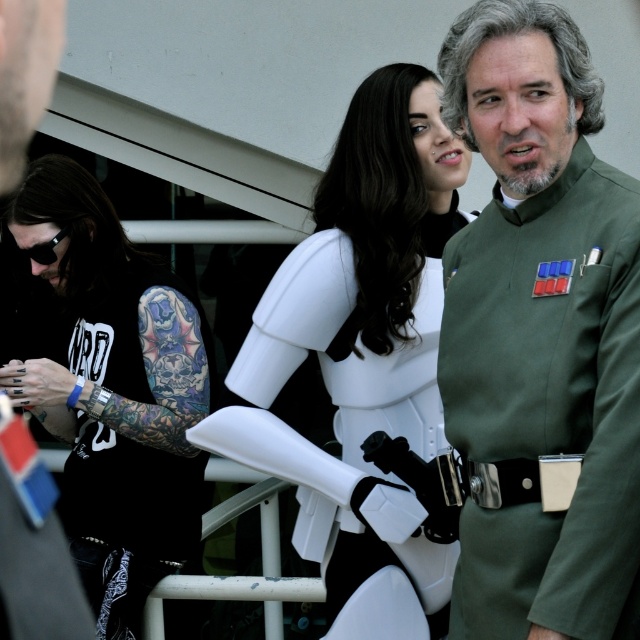
Describe the element at coordinates (372, 266) in the screenshot. The height and width of the screenshot is (640, 640). I see `white matte armor at center` at that location.

Can you confirm if white matte armor at center is positioned below matte green uniform at center right?

Yes.

Find the location of a particular element. The width and height of the screenshot is (640, 640). white matte armor at center is located at coordinates (372, 266).

Consider the image. Is white matte stormtrooper armor at center to the right of matte green uniform at center right from the viewer's perspective?

Incorrect, white matte stormtrooper armor at center is not on the right side of matte green uniform at center right.

Is white matte stormtrooper armor at center smaller than matte green uniform at center right?

No, white matte stormtrooper armor at center is not smaller than matte green uniform at center right.

At what (x,y) coordinates should I click in order to perform the action: click on white matte stormtrooper armor at center. Please return your answer as a coordinate pair (x, y). Looking at the image, I should click on (113, 390).

Can you confirm if white matte stormtrooper armor at center is positioned above white matte armor at center?

Incorrect, white matte stormtrooper armor at center is not positioned above white matte armor at center.

What do you see at coordinates (113, 390) in the screenshot?
I see `white matte stormtrooper armor at center` at bounding box center [113, 390].

Between point (198, 472) and point (308, 260), which one is positioned in front?

Positioned in front is point (308, 260).

This screenshot has height=640, width=640. Find the location of `white matte stormtrooper armor at center`. white matte stormtrooper armor at center is located at coordinates (113, 390).